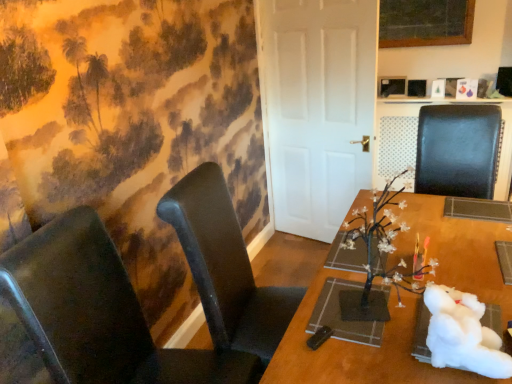
Find the location of `white matte door at center`. white matte door at center is located at coordinates (317, 107).

Find the location of a particular element. This screenshot has width=512, height=384. black leather chair at left, the second chair viewed from the left is located at coordinates pos(226,266).

How much space does black leather chair at right, marked as the 3th chair in a left-to-right arrangement, occupy horizontally?

black leather chair at right, marked as the 3th chair in a left-to-right arrangement, is 23.08 inches wide.

Find the location of `white matte door at center`. white matte door at center is located at coordinates (317, 107).

From the image's perspective, is wooden table at center located above black leather chair at right, the first chair positioned from the right?

No.

Considering the relative positions of wooden table at center and black leather chair at right, the first chair positioned from the right, in the image provided, is wooden table at center to the right of black leather chair at right, the first chair positioned from the right, from the viewer's perspective?

No.

Considering the sizes of wooden table at center and black leather chair at right, marked as the 3th chair in a left-to-right arrangement, in the image, is wooden table at center wider or thinner than black leather chair at right, marked as the 3th chair in a left-to-right arrangement,?

wooden table at center is wider than black leather chair at right, marked as the 3th chair in a left-to-right arrangement.

Would you say wooden table at center is outside black leather chair at right, the first chair positioned from the right?

Absolutely, wooden table at center is external to black leather chair at right, the first chair positioned from the right.

From the image's perspective, relative to black leather chair at right, the first chair positioned from the right, is black leather chair at left, the second chair viewed from the left, above or below?

black leather chair at left, the second chair viewed from the left, is situated lower than black leather chair at right, the first chair positioned from the right, in the image.

Which object is wider, black leather chair at left, the second chair viewed from the left, or black leather chair at right, marked as the 3th chair in a left-to-right arrangement?

black leather chair at left, the second chair viewed from the left.

How far apart are black leather chair at left, the second chair viewed from the left, and black leather chair at right, the first chair positioned from the right?

black leather chair at left, the second chair viewed from the left, is 4.20 feet away from black leather chair at right, the first chair positioned from the right.

Does black leather chair at left, the second chair viewed from the left, lie behind black leather chair at right, the first chair positioned from the right?

No, black leather chair at left, the second chair viewed from the left, is closer to the viewer.

From the image's perspective, is black leather chair at right, marked as the 3th chair in a left-to-right arrangement, above white matte door at center?

No, from the image's perspective, black leather chair at right, marked as the 3th chair in a left-to-right arrangement, is not on top of white matte door at center.

Between black leather chair at right, marked as the 3th chair in a left-to-right arrangement, and white matte door at center, which one has smaller size?

white matte door at center.

Is black leather chair at right, marked as the 3th chair in a left-to-right arrangement, wider than white matte door at center?

Correct, the width of black leather chair at right, marked as the 3th chair in a left-to-right arrangement, exceeds that of white matte door at center.

Is black leather chair at left, the second chair viewed from the left, not inside matte black chair at left, positioned as the 3th chair in right-to-left order?

Absolutely, black leather chair at left, the second chair viewed from the left, is external to matte black chair at left, positioned as the 3th chair in right-to-left order.

Is point (211, 291) positioned behind point (201, 364)?

Yes, point (211, 291) is farther from viewer.

Considering the relative sizes of black leather chair at left, which appears as the 2th chair when viewed from the right, and matte black chair at left, positioned as the 3th chair in right-to-left order, in the image provided, is black leather chair at left, which appears as the 2th chair when viewed from the right, shorter than matte black chair at left, positioned as the 3th chair in right-to-left order,?

In fact, black leather chair at left, which appears as the 2th chair when viewed from the right, may be taller than matte black chair at left, positioned as the 3th chair in right-to-left order.

Consider the image. Are black leather chair at left, the second chair viewed from the left, and matte black chair at left, positioned as the 3th chair in right-to-left order, beside each other?

black leather chair at left, the second chair viewed from the left, and matte black chair at left, positioned as the 3th chair in right-to-left order, are not in contact.

Does white matte door at center contain wooden table at center?

That's incorrect, wooden table at center is not inside white matte door at center.

Are white matte door at center and wooden table at center located far from each other?

A: Indeed, white matte door at center is not near wooden table at center.

Based on the photo, from a real-world perspective, is white matte door at center physically below wooden table at center?

No, from a real-world perspective, white matte door at center is not under wooden table at center.

Which of these two, white matte door at center or wooden table at center, is bigger?

With larger size is wooden table at center.

Is white matte door at center at the left side of black leather chair at left, the second chair viewed from the left?

Incorrect, white matte door at center is not on the left side of black leather chair at left, the second chair viewed from the left.

Looking at this image, would you say white matte door at center contains black leather chair at left, the second chair viewed from the left?

No, black leather chair at left, the second chair viewed from the left, is located outside of white matte door at center.

Find the location of a particular element. door lying behind the black leather chair at left, which appears as the 2th chair when viewed from the right is located at coordinates (317, 107).

Is black leather chair at left, the second chair viewed from the left, at the back of white matte door at center?

Yes, black leather chair at left, the second chair viewed from the left, is at the back of white matte door at center.

Can you confirm if white matte door at center is wider than black leather chair at right, the first chair positioned from the right?

In fact, white matte door at center might be narrower than black leather chair at right, the first chair positioned from the right.

Is white matte door at center completely or partially outside of black leather chair at right, marked as the 3th chair in a left-to-right arrangement?

Yes, white matte door at center is outside of black leather chair at right, marked as the 3th chair in a left-to-right arrangement.

Can you confirm if white matte door at center is taller than black leather chair at right, the first chair positioned from the right?

Yes.

There is a white matte door at center. Where is `the 1st chair below it (from a real-world perspective)`? This screenshot has width=512, height=384. the 1st chair below it (from a real-world perspective) is located at coordinates (457, 150).

At what (x,y) coordinates should I click in order to perform the action: click on the 3rd chair positioned above the wooden table at center (from a real-world perspective). Please return your answer as a coordinate pair (x, y). This screenshot has height=384, width=512. Looking at the image, I should click on (457, 150).

The width and height of the screenshot is (512, 384). Identify the location of chair that is the 1st one when counting downward from the black leather chair at right, the first chair positioned from the right (from the image's perspective). (226, 266).

Looking at the image, which one is located further to black leather chair at left, which appears as the 2th chair when viewed from the right, matte black chair at left, positioned as the 3th chair in right-to-left order, or white matte door at center?

Among the two, white matte door at center is located further to black leather chair at left, which appears as the 2th chair when viewed from the right.

Looking at this image, based on their spatial positions, is black leather chair at right, the first chair positioned from the right, or matte black chair at left, placed as the 1th chair when sorted from left to right, further from white matte door at center?

matte black chair at left, placed as the 1th chair when sorted from left to right, is positioned further to the anchor white matte door at center.

In the scene shown: Estimate the real-world distances between objects in this image. Which object is further from wooden table at center, white matte door at center or black leather chair at left, the second chair viewed from the left?

The object further to wooden table at center is white matte door at center.

Estimate the real-world distances between objects in this image. Which object is closer to white matte door at center, black leather chair at left, which appears as the 2th chair when viewed from the right, or black leather chair at right, the first chair positioned from the right?

black leather chair at right, the first chair positioned from the right.

Based on their spatial positions, is black leather chair at right, the first chair positioned from the right, or wooden table at center closer to white matte door at center?

black leather chair at right, the first chair positioned from the right, is positioned closer to the anchor white matte door at center.

Which object lies nearer to the anchor point black leather chair at left, the second chair viewed from the left, black leather chair at right, marked as the 3th chair in a left-to-right arrangement, or matte black chair at left, placed as the 1th chair when sorted from left to right?

matte black chair at left, placed as the 1th chair when sorted from left to right, lies closer to black leather chair at left, the second chair viewed from the left, than the other object.

Estimate the real-world distances between objects in this image. Which object is closer to white matte door at center, black leather chair at right, marked as the 3th chair in a left-to-right arrangement, or black leather chair at left, which appears as the 2th chair when viewed from the right?

black leather chair at right, marked as the 3th chair in a left-to-right arrangement, lies closer to white matte door at center than the other object.

Considering their positions, is white matte door at center positioned closer to matte black chair at left, placed as the 1th chair when sorted from left to right, than black leather chair at right, the first chair positioned from the right?

black leather chair at right, the first chair positioned from the right.

In order to click on chair between matte black chair at left, positioned as the 3th chair in right-to-left order, and black leather chair at right, marked as the 3th chair in a left-to-right arrangement, from left to right in this screenshot , I will do `click(226, 266)`.

Identify the location of chair between matte black chair at left, placed as the 1th chair when sorted from left to right, and wooden table at center, in the horizontal direction. (226, 266).

Where is `chair between white matte door at center and black leather chair at left, which appears as the 2th chair when viewed from the right, from top to bottom`? This screenshot has height=384, width=512. chair between white matte door at center and black leather chair at left, which appears as the 2th chair when viewed from the right, from top to bottom is located at coordinates (457, 150).

Locate an element on the screen. table located between matte black chair at left, placed as the 1th chair when sorted from left to right, and black leather chair at right, the first chair positioned from the right, in the left-right direction is located at coordinates (357, 349).